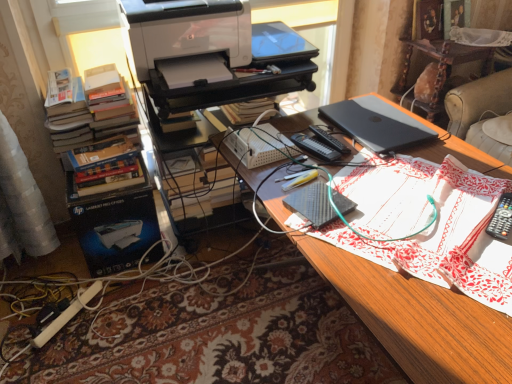
In order to click on free point above black plastic laptop at upper right, marked as the second computer desk in a left-to-right arrangement (from a real-world perspective) in this screenshot , I will do `click(454, 41)`.